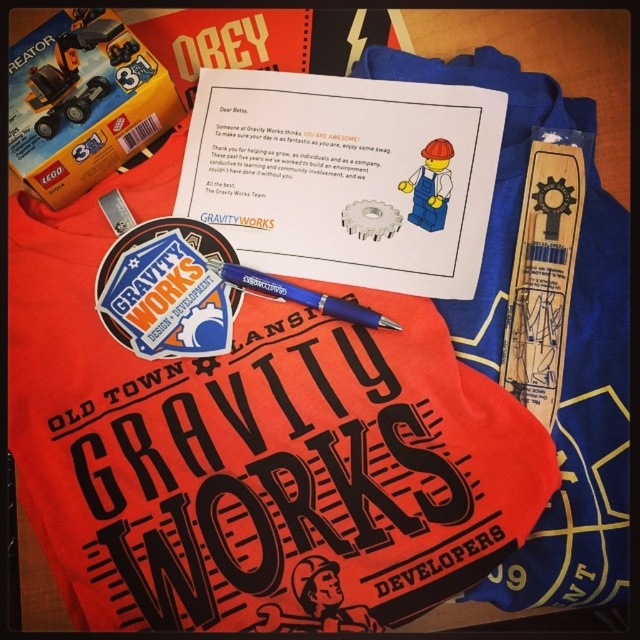
What is the exact coordinate of the matte sticker at center?

The matte sticker at center is located at point (166, 291).

You are organizing a promotional event and need to place a small company logo sticker on the wooden surface. The existing items include a matte sticker at center and a matte plastic minifigure at center. Which item should you avoid placing the new sticker over to ensure it is visible?

You should avoid placing the new sticker over the matte sticker at center because it is bigger than the matte plastic minifigure at center, making it harder to see the new sticker if placed there.